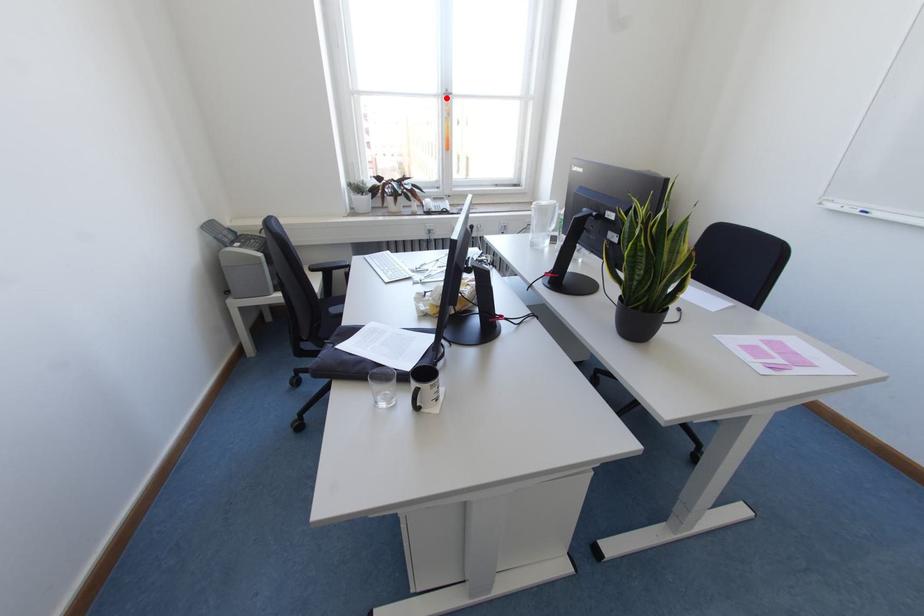
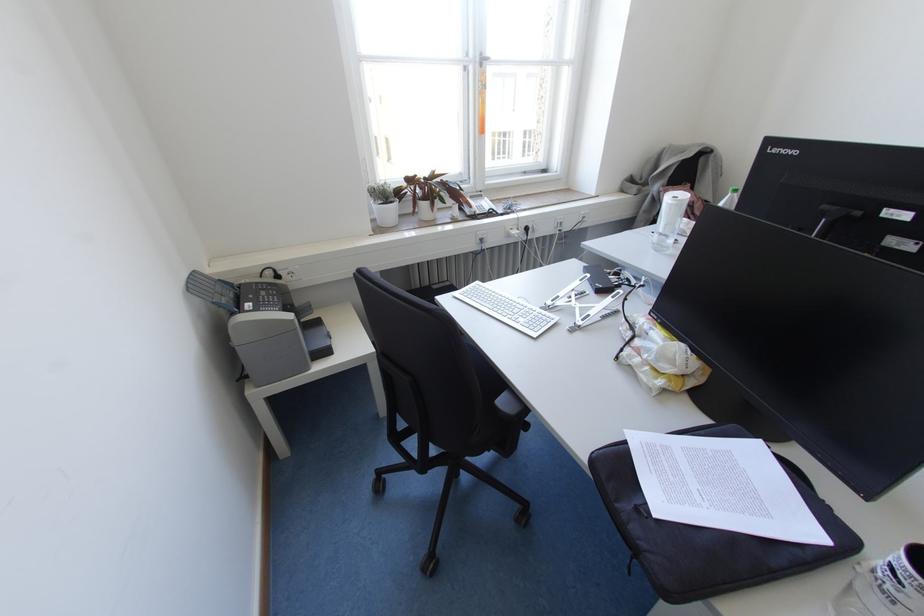
Find the pixel in the second image that matches the highlighted location in the first image.

(480, 65)